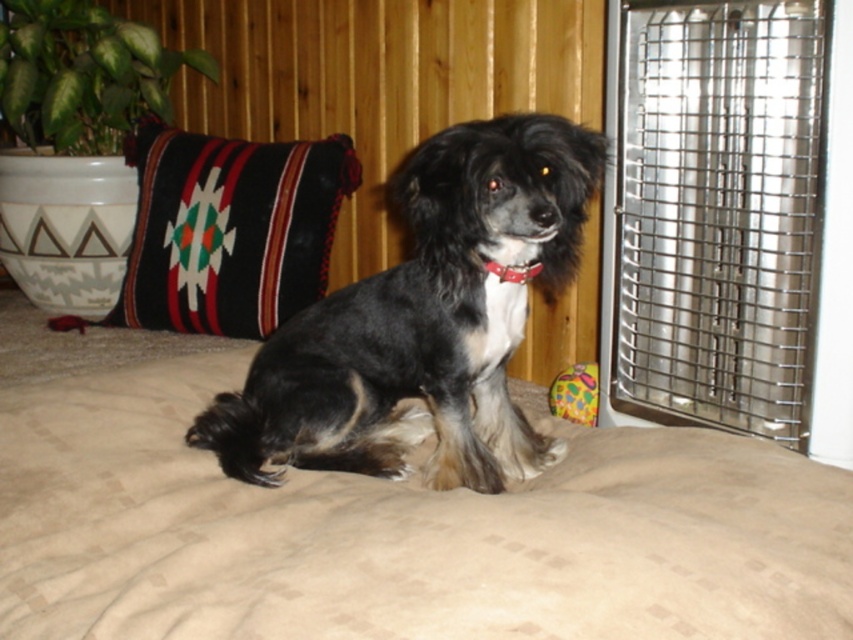
Question: Does black woven pillow at upper left appear over red leather collar at center?

Choices:
 (A) yes
 (B) no

Answer: (A)

Question: Where is metallic grid heater at right located in relation to black woven pillow at upper left in the image?

Choices:
 (A) below
 (B) above

Answer: (A)

Question: Can you confirm if beige fabric dog bed at center is positioned below black fur dog at center?

Choices:
 (A) yes
 (B) no

Answer: (A)

Question: Which object appears closest to the camera in this image?

Choices:
 (A) black fur dog at center
 (B) red leather collar at center

Answer: (A)

Question: Which of the following is the farthest from the observer?

Choices:
 (A) metallic grid heater at right
 (B) black fur dog at center

Answer: (A)

Question: Estimate the real-world distances between objects in this image. Which object is farther from the black fur dog at center?

Choices:
 (A) beige fabric dog bed at center
 (B) black woven pillow at upper left

Answer: (B)